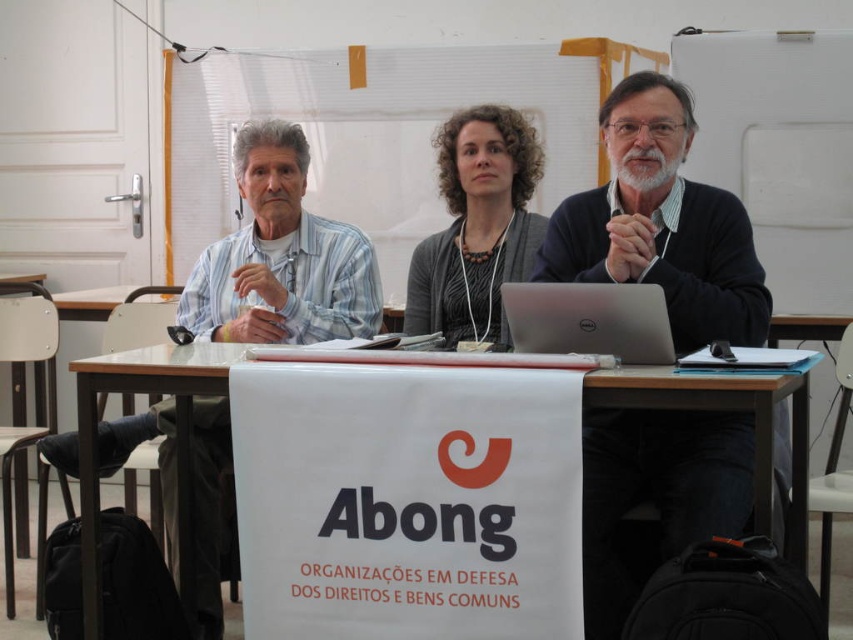
Question: Is white wood table at center wider than silver metallic laptop at center?

Choices:
 (A) no
 (B) yes

Answer: (B)

Question: From the image, what is the correct spatial relationship of light blue striped shirt at left in relation to dark gray sweater at center?

Choices:
 (A) right
 (B) left

Answer: (B)

Question: Is dark blue sweater at center further to the viewer compared to white wood table at center?

Choices:
 (A) yes
 (B) no

Answer: (B)

Question: Which of the following is the closest to the observer?

Choices:
 (A) white wood table at center
 (B) silver metallic laptop at center
 (C) light blue striped shirt at left
 (D) dark blue sweater at center

Answer: (D)

Question: Which point is closer to the camera?

Choices:
 (A) (463, 262)
 (B) (254, 129)
 (C) (634, 259)
 (D) (741, 381)

Answer: (D)

Question: Which of the following is the farthest from the observer?

Choices:
 (A) silver metallic laptop at center
 (B) white wood table at center

Answer: (B)